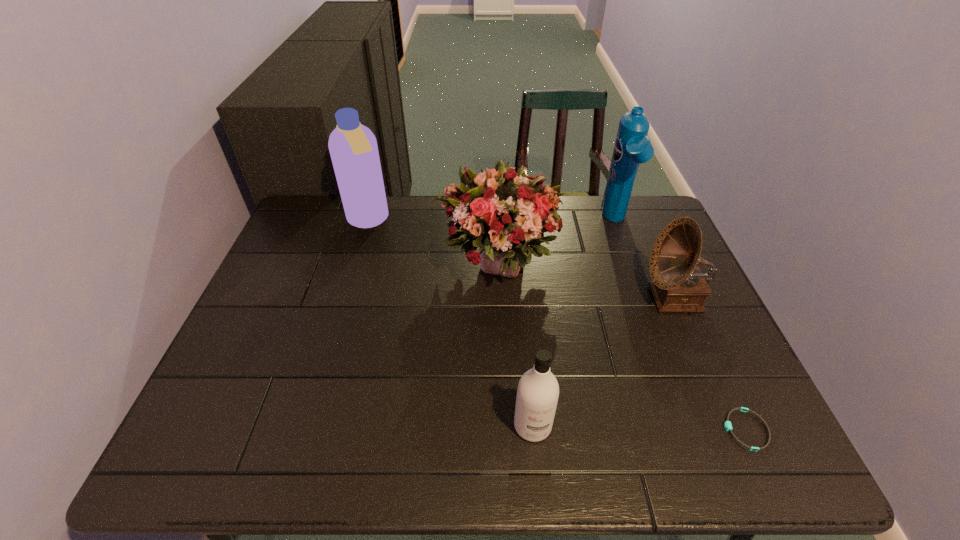
Identify the location of the leftmost shampoo. (353, 148).

You are a GUI agent. You are given a task and a screenshot of the screen. Output one action in this format:
    pyautogui.click(x=<x>, y=<y>)
    Task: Click on the rightmost shampoo
    Image resolution: width=960 pixels, height=540 pixels.
    Given the screenshot: What is the action you would take?
    pyautogui.click(x=632, y=147)

You are a GUI agent. You are given a task and a screenshot of the screen. Output one action in this format:
    pyautogui.click(x=<x>, y=<y>)
    Task: Click on the bouquet
    The height and width of the screenshot is (540, 960).
    Given the screenshot: What is the action you would take?
    pyautogui.click(x=505, y=213)

Where is `phonograph record`? phonograph record is located at coordinates (678, 286).

What are the coordinates of `the second shampoo from right to left` in the screenshot? It's located at point(537,394).

Find the location of a particular element. the shortest shampoo is located at coordinates (537, 394).

Where is `wristband`? This screenshot has height=540, width=960. wristband is located at coordinates (727, 425).

Locate an element on the screen. vacant space located on the front of the leftmost object is located at coordinates (345, 298).

Locate an element on the screen. This screenshot has height=540, width=960. vacant space located 0.140m on the left of the rightmost shampoo is located at coordinates (560, 221).

I want to click on vacant space located on the left of the bouquet, so click(x=418, y=264).